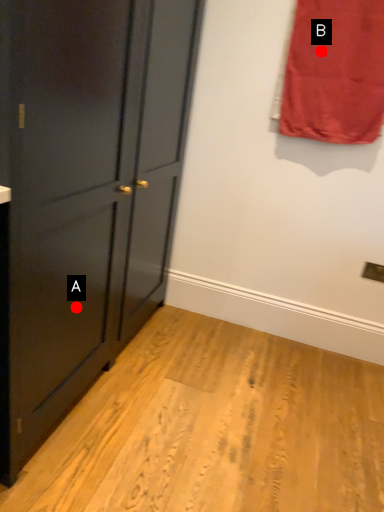
Question: Two points are circled on the image, labeled by A and B beside each circle. Among these points, which one is farthest from the camera?

Choices:
 (A) A is further
 (B) B is further

Answer: (B)